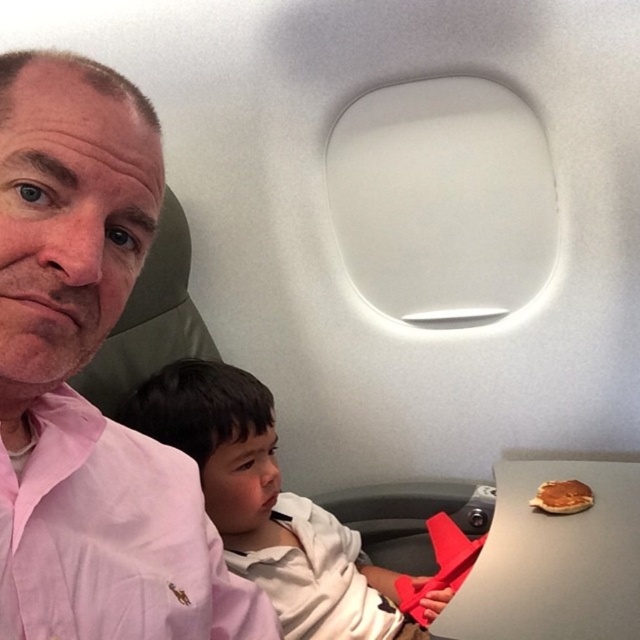
Who is more forward, (58,193) or (577,484)?

Point (58,193)

Who is positioned more to the left, pink fabric shirt at left or golden brown pancake at lower right?

pink fabric shirt at left

Does point (29, 484) come behind point (545, 484)?

No, (29, 484) is in front of (545, 484).

Find the location of a particular element. The image size is (640, 640). pink fabric shirt at left is located at coordinates (77, 369).

Can you confirm if pink fabric shirt at left is bigger than white cotton shirt at center?

No.

Between point (12, 113) and point (241, 449), which one is positioned behind?

Positioned behind is point (241, 449).

Find the location of a particular element. The height and width of the screenshot is (640, 640). pink fabric shirt at left is located at coordinates (77, 369).

Does pink cotton shirt at left appear over golden brown pancake at lower right?

Correct, pink cotton shirt at left is located above golden brown pancake at lower right.

Is pink cotton shirt at left taller than golden brown pancake at lower right?

Yes, pink cotton shirt at left is taller than golden brown pancake at lower right.

Does point (22, 484) come in front of point (576, 493)?

Yes.

Identify the location of pink cotton shirt at left. (113, 538).